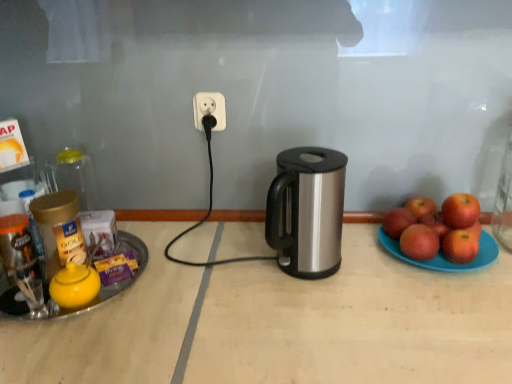
At what (x,y) coordinates should I click in order to perform the action: click on unoccupied region to the right of gold plastic jar at left, the third bottle in the back-to-front sequence. Please return your answer as a coordinate pair (x, y). Looking at the image, I should click on (130, 266).